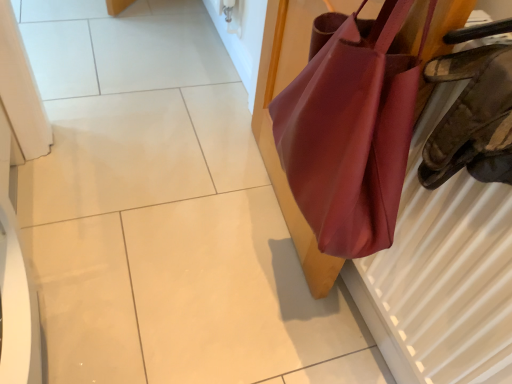
Locate an element on the screen. free space underneath matte leather handbag at right (from a real-world perspective) is located at coordinates (269, 190).